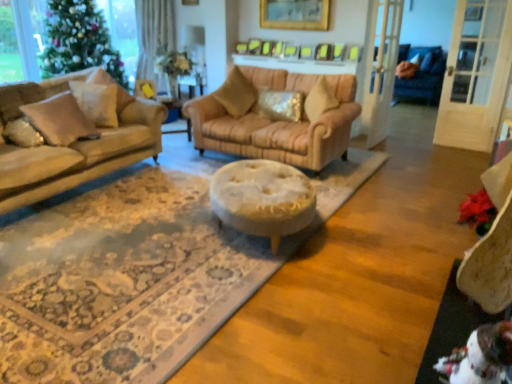
Question: Relative to velvet beige swivel chair at lower right, is matte gold pillow at left, the 1th pillow in the left-to-right sequence, in front or behind?

Choices:
 (A) front
 (B) behind

Answer: (B)

Question: Is matte gold pillow at left, the 5th pillow in the right-to-left sequence, bigger or smaller than velvet beige swivel chair at lower right?

Choices:
 (A) small
 (B) big

Answer: (A)

Question: Which is nearer to the matte gold pillow at left, the 5th pillow in the right-to-left sequence?

Choices:
 (A) metallic sequined pillow at center, arranged as the 1th pillow when viewed from the right
 (B) green matte christmas tree at left
 (C) beige fabric pillow at center, the 4th pillow in the left-to-right sequence
 (D) velvet beige swivel chair at lower right
 (E) beige fabric pillow at left, which is the 3th pillow in left-to-right order

Answer: (E)

Question: Based on their relative distances, which object is farther from the matte gold pillow at left, the 5th pillow in the right-to-left sequence?

Choices:
 (A) beige fabric pillow at center, the 2th pillow when ordered from right to left
 (B) beige fabric pillow at left, the 4th pillow positioned from the right
 (C) beige fabric pillow at left, the third pillow when ordered from right to left
 (D) green matte christmas tree at left
 (E) metallic sequined pillow at center, arranged as the 1th pillow when viewed from the right

Answer: (D)